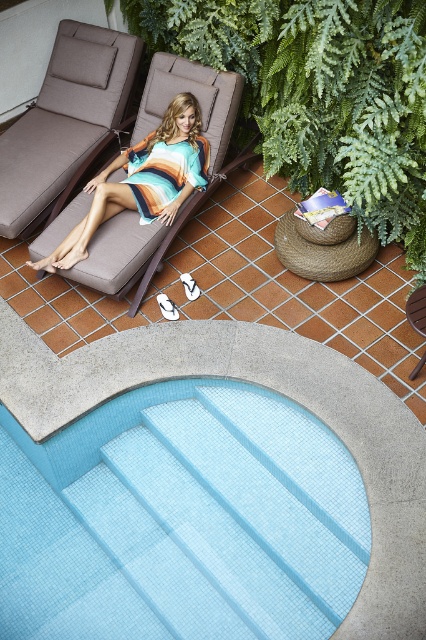
You are standing at the camera position and want to know how far the point at coordinates (420, 280) is from you. Can you determine the distance?

The distance of point (420, 280) from the camera is 4.29 meters.

You are a gardener who wants to place a new small potted plant between the green leafy plant at upper center and the matte brown chaise lounge at upper left. Based on their widths, can you determine if there is enough space for the new plant?

The green leafy plant at upper center might be wider than the matte brown chaise lounge at upper left, so there may not be enough space between them for the new potted plant.

You are a photographer standing at the edge of the light blue tile swimming pool at lower center. You want to take a photo of the striped cotton dress at center. Will the swimming pool block your view of the dress?

The light blue tile swimming pool at lower center is much taller than the striped cotton dress at center. Since the pool is taller, it will block your view of the dress.